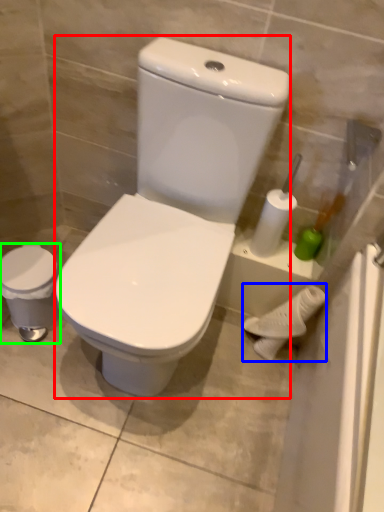
Question: Which object is the closest to the porcelain (highlighted by a red box)? Choose among these: porcelain (highlighted by a blue box) or porcelain (highlighted by a green box).

Choices:
 (A) porcelain
 (B) porcelain

Answer: (B)